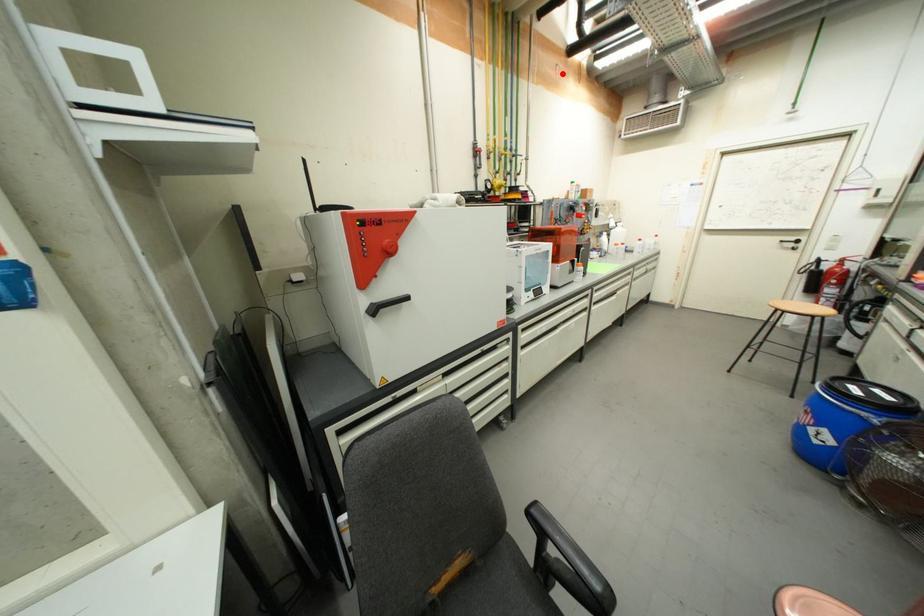
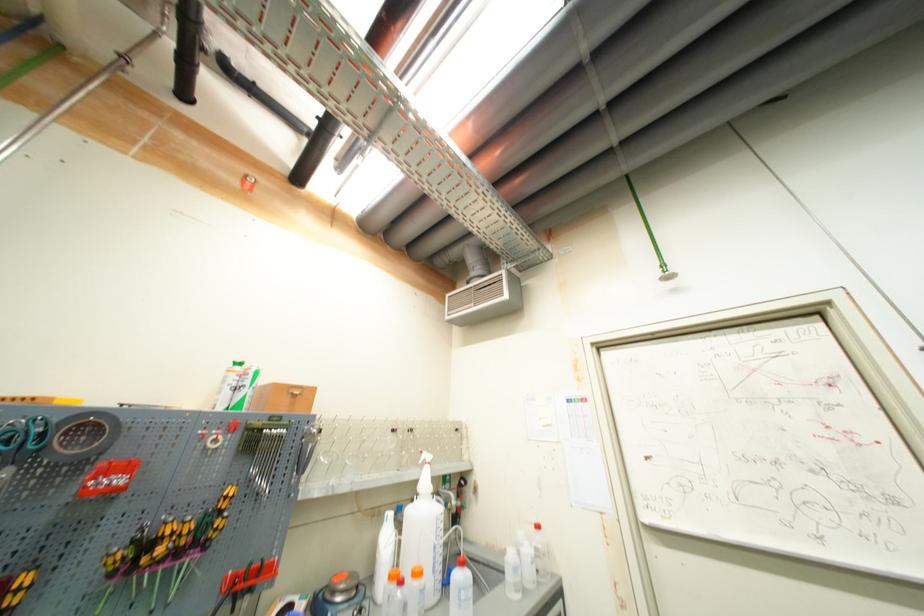
Where in the second image is the point corresponding to the highlighted location from the first image?

(253, 185)